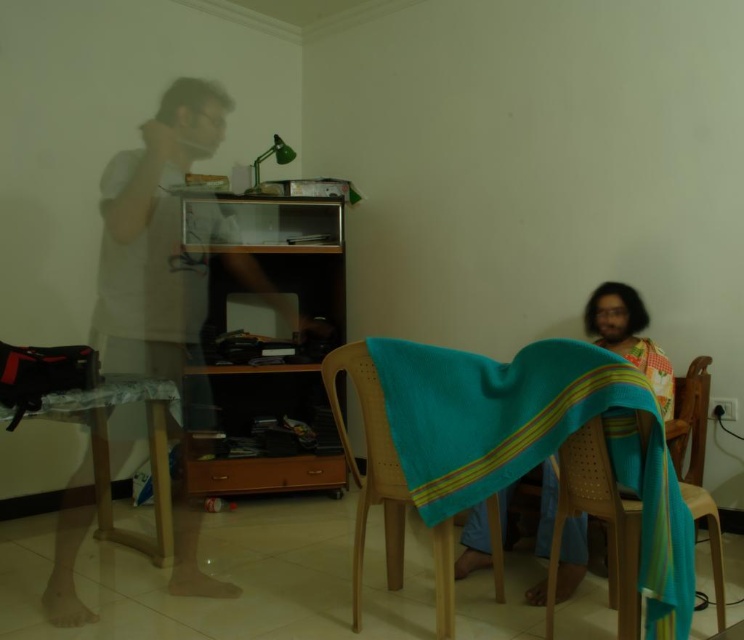
You are standing in the living room and need to move from the wooden table at lower left to the wooden chair with woven seat at lower right. Which direction should you move to reach the chair?

You should move to the right to reach the wooden chair with woven seat at lower right because the wooden table at lower left is located to the left of the chair.

You are arranging a small plant in the living room and need to place it on either the turquoise woven cloth at center or the wooden table at lower left. Which surface is higher and thus better for the plant to receive sunlight through the window above?

The turquoise woven cloth at center is located above the wooden table at lower left, so placing the plant there would provide better sunlight exposure.